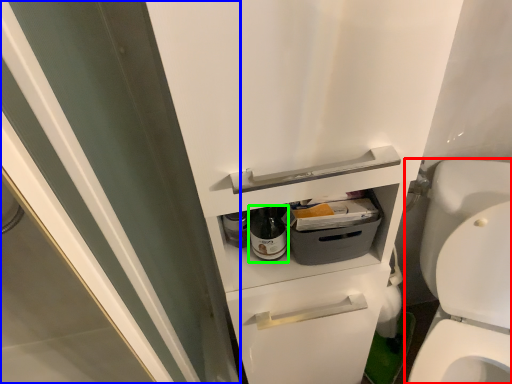
Question: Which object is the closest to the toilet (highlighted by a red box)? Choose among these: screen door (highlighted by a blue box) or bottle (highlighted by a green box).

Choices:
 (A) screen door
 (B) bottle

Answer: (B)